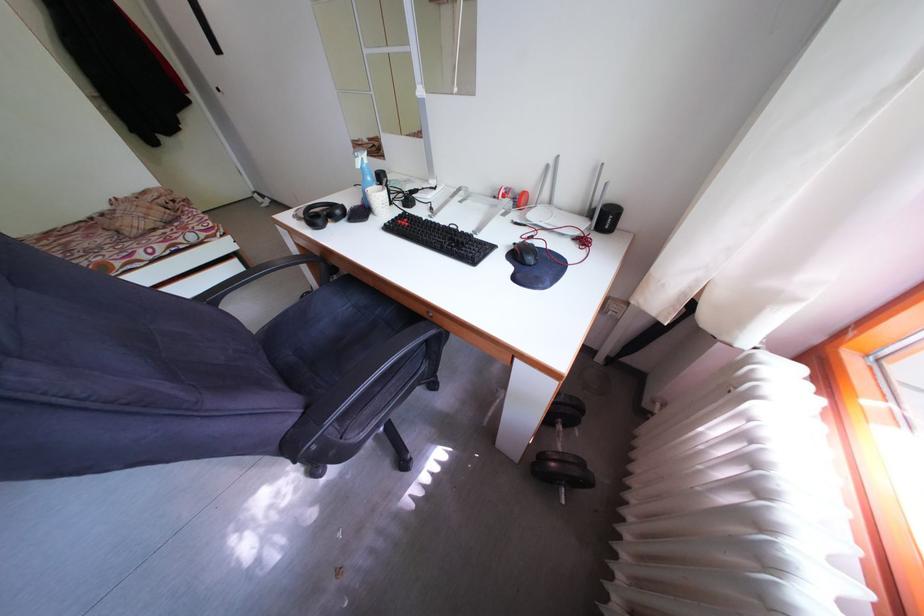
Find where to lift the patterned white mug. Please return your answer as a coordinate pair (x, y).

(379, 201)